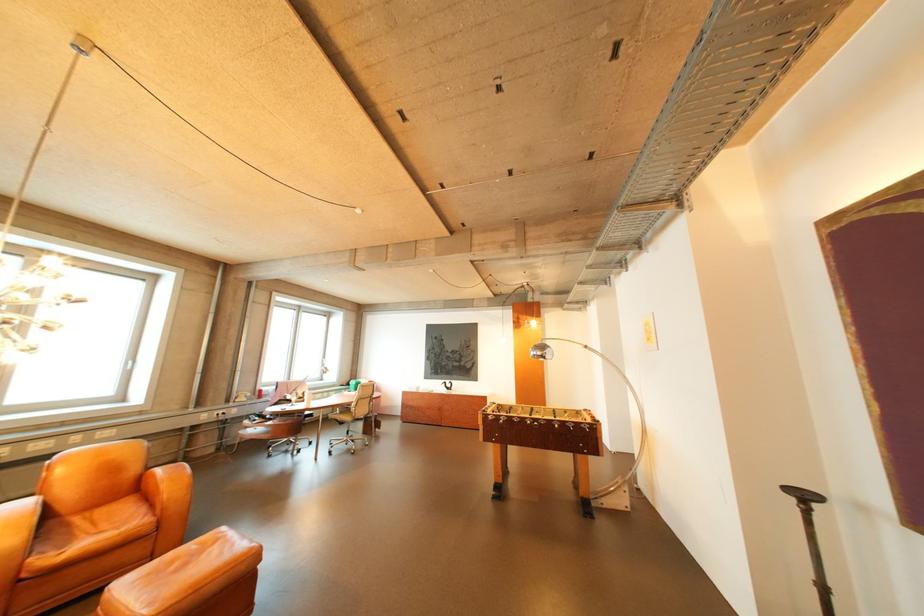
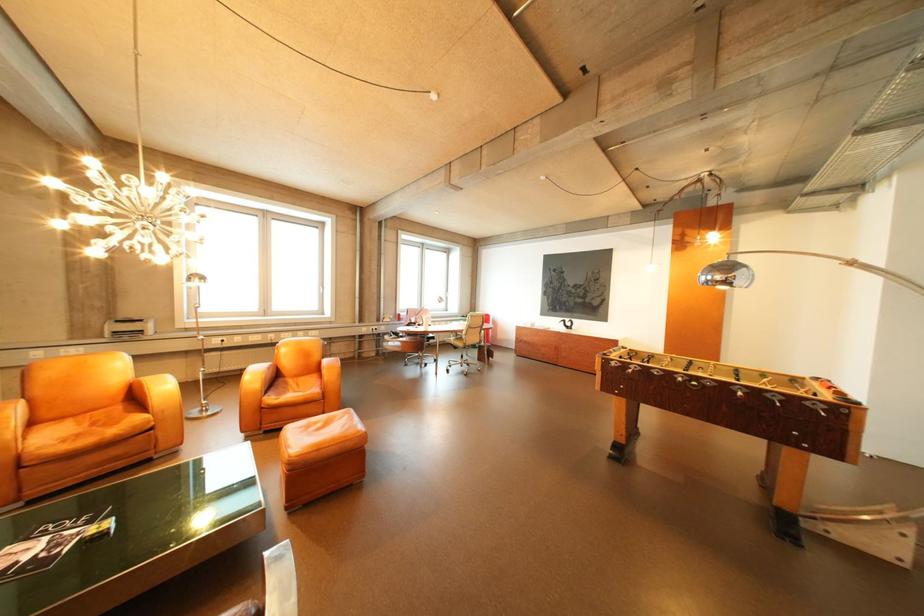
Locate, in the second image, the point that corresponds to (511,419) in the first image.

(638, 367)